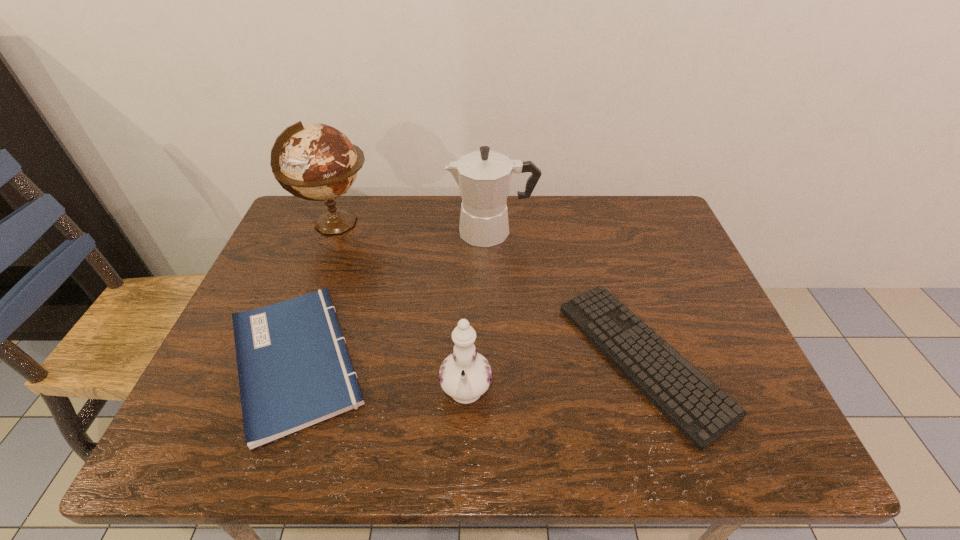
At what (x,y) coordinates should I click in order to perform the action: click on vacant space that satisfies the following two spatial constraints: 1. on the front of the globe showing Asia; 2. on the right side of the computer keyboard. Please return your answer as a coordinate pair (x, y). The image size is (960, 540). Looking at the image, I should click on (284, 358).

Find the location of a particular element. vacant region that satisfies the following two spatial constraints: 1. on the front of the tallest object showing Asia; 2. on the back side of the rightmost object is located at coordinates (284, 358).

Find the location of a particular element. vacant region that satisfies the following two spatial constraints: 1. on the front of the tallest object showing Asia; 2. on the right side of the second shortest object is located at coordinates (283, 361).

Find the location of a particular element. The height and width of the screenshot is (540, 960). vacant position in the image that satisfies the following two spatial constraints: 1. at the spout of the shortest object; 2. on the left side of the coffeepot is located at coordinates (496, 358).

Locate an element on the screen. Image resolution: width=960 pixels, height=540 pixels. free space that satisfies the following two spatial constraints: 1. at the spout of the fourth shortest object; 2. on the front side of the paperback book is located at coordinates (496, 361).